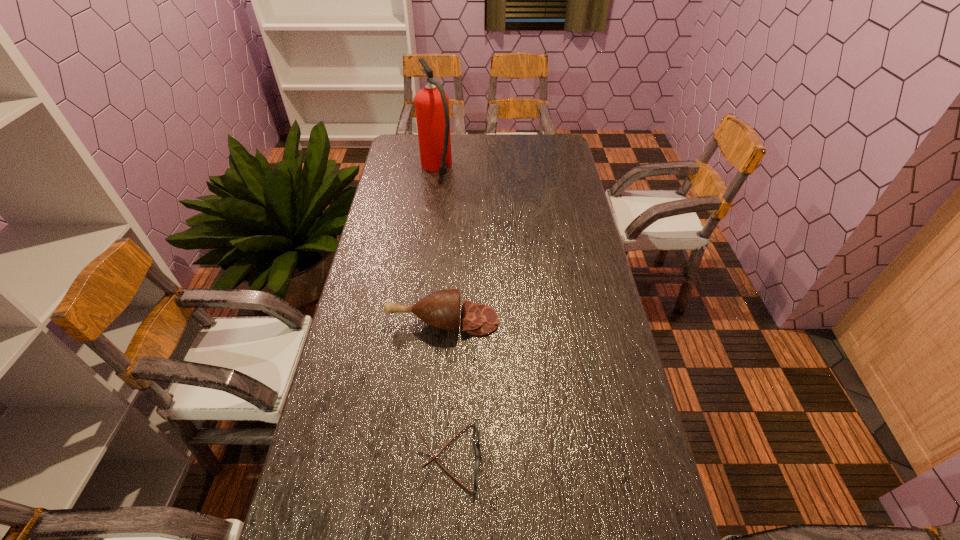
Find the location of `object that stands as the closest to the tallest object`. object that stands as the closest to the tallest object is located at coordinates (441, 309).

The image size is (960, 540). Identify the location of object that can be found as the closest to the tallest object. (441, 309).